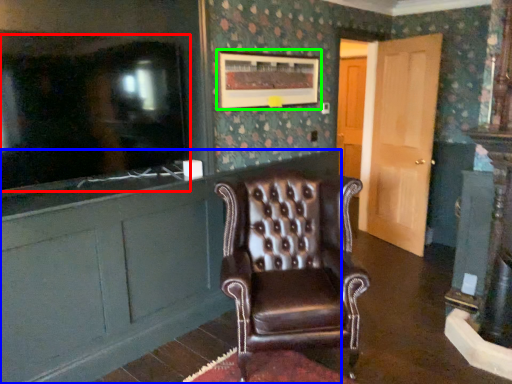
Question: Which is nearer to the tv show (highlighted by a red box)? cabinetry (highlighted by a blue box) or picture frame (highlighted by a green box).

Choices:
 (A) cabinetry
 (B) picture frame

Answer: (A)